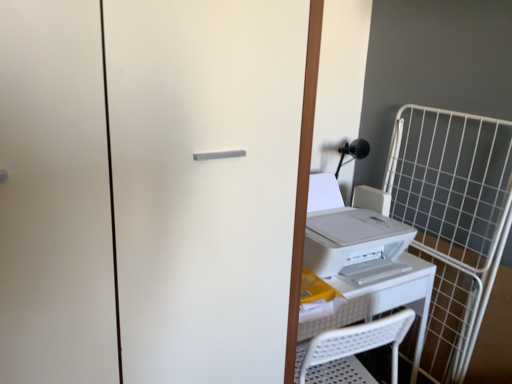
Question: From a real-world perspective, relative to white wire cage at right, is white plastic printer at right vertically above or below?

Choices:
 (A) above
 (B) below

Answer: (A)

Question: In terms of width, does white plastic printer at right look wider or thinner when compared to white wire cage at right?

Choices:
 (A) wide
 (B) thin

Answer: (A)

Question: Which of these objects is positioned closest to the white plastic table at center?

Choices:
 (A) white wire cage at right
 (B) white matte screen door at center
 (C) white plastic printer at right

Answer: (C)

Question: Which of these objects is positioned closest to the white matte screen door at center?

Choices:
 (A) white wire cage at right
 (B) white plastic printer at right
 (C) white plastic table at center

Answer: (B)